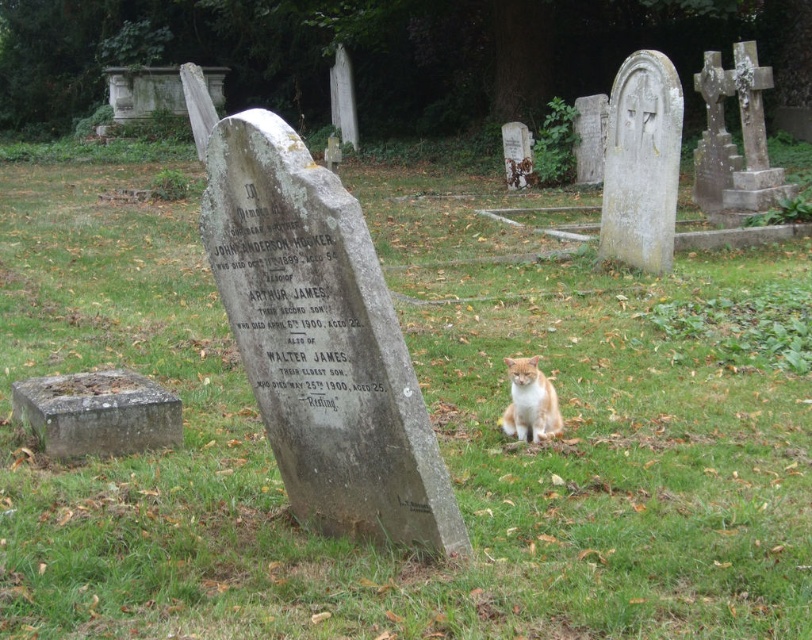
Question: Does gray stone at lower left have a greater width compared to orange fur cat at center?

Choices:
 (A) yes
 (B) no

Answer: (A)

Question: Is gray stone at lower left thinner than orange fur cat at center?

Choices:
 (A) yes
 (B) no

Answer: (B)

Question: Can you confirm if gray stone at lower left is thinner than orange fur cat at center?

Choices:
 (A) yes
 (B) no

Answer: (B)

Question: Among these points, which one is nearest to the camera?

Choices:
 (A) (63, 419)
 (B) (534, 360)

Answer: (A)